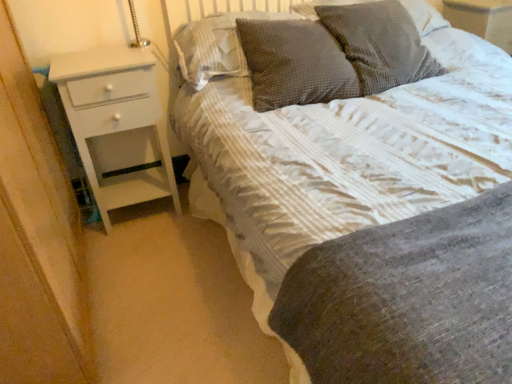
Question: Considering the relative positions of white textured bed at center and dark grey textured pillow at upper center, positioned as the third pillow in right-to-left order, in the image provided, is white textured bed at center to the left of dark grey textured pillow at upper center, positioned as the third pillow in right-to-left order, from the viewer's perspective?

Choices:
 (A) no
 (B) yes

Answer: (A)

Question: Is white textured bed at center in front of dark grey textured pillow at upper center, placed as the second pillow when sorted from left to right?

Choices:
 (A) no
 (B) yes

Answer: (B)

Question: Does white textured bed at center have a greater height compared to dark grey textured pillow at upper center, positioned as the third pillow in right-to-left order?

Choices:
 (A) no
 (B) yes

Answer: (B)

Question: Is white textured bed at center further to the viewer compared to dark grey textured pillow at upper center, placed as the second pillow when sorted from left to right?

Choices:
 (A) yes
 (B) no

Answer: (B)

Question: Is dark grey textured pillow at upper center, placed as the second pillow when sorted from left to right, at the back of white textured bed at center?

Choices:
 (A) no
 (B) yes

Answer: (B)

Question: Does white textured bed at center turn towards dark grey textured pillow at upper center, placed as the second pillow when sorted from left to right?

Choices:
 (A) no
 (B) yes

Answer: (A)

Question: Considering the relative sizes of white glossy chest of drawers at left and woven fabric pillow at upper center, positioned as the 3th pillow in left-to-right order, in the image provided, is white glossy chest of drawers at left smaller than woven fabric pillow at upper center, positioned as the 3th pillow in left-to-right order,?

Choices:
 (A) no
 (B) yes

Answer: (A)

Question: Considering the relative sizes of white glossy chest of drawers at left and woven fabric pillow at upper center, which is the second pillow from right to left, in the image provided, is white glossy chest of drawers at left wider than woven fabric pillow at upper center, which is the second pillow from right to left,?

Choices:
 (A) no
 (B) yes

Answer: (A)

Question: Does white glossy chest of drawers at left appear on the left side of woven fabric pillow at upper center, which is the second pillow from right to left?

Choices:
 (A) no
 (B) yes

Answer: (B)

Question: From the image's perspective, is white glossy chest of drawers at left under woven fabric pillow at upper center, positioned as the 3th pillow in left-to-right order?

Choices:
 (A) yes
 (B) no

Answer: (A)

Question: Could you tell me if white glossy chest of drawers at left is turned towards woven fabric pillow at upper center, positioned as the 3th pillow in left-to-right order?

Choices:
 (A) no
 (B) yes

Answer: (A)

Question: From a real-world perspective, does white glossy chest of drawers at left stand above woven fabric pillow at upper center, which is the second pillow from right to left?

Choices:
 (A) yes
 (B) no

Answer: (B)

Question: Is waffle-textured gray pillow at upper center, acting as the 1th pillow starting from the left, facing away from white textured bed at center?

Choices:
 (A) yes
 (B) no

Answer: (A)